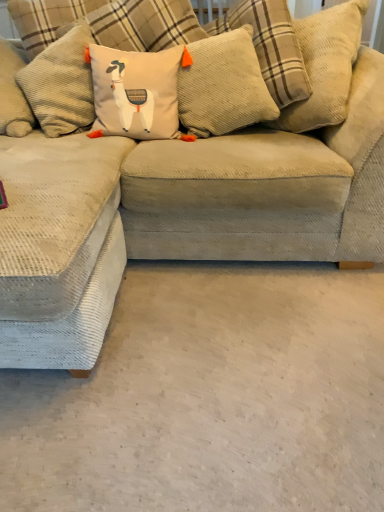
Question: Which direction should I rotate to look at corduroy pillow at center, arranged as the third pillow when viewed from the left, — up or down?

Choices:
 (A) down
 (B) up

Answer: (B)

Question: Can you confirm if corduroy pillow at center, the 2th pillow from the right, is wider than beige corduroy couch at center?

Choices:
 (A) no
 (B) yes

Answer: (A)

Question: Is corduroy pillow at center, the 2th pillow from the right, positioned behind beige corduroy couch at center?

Choices:
 (A) no
 (B) yes

Answer: (B)

Question: Does corduroy pillow at center, placed as the second pillow when sorted from left to right, have a lesser width compared to beige corduroy couch at center?

Choices:
 (A) yes
 (B) no

Answer: (A)

Question: Is corduroy pillow at center, placed as the second pillow when sorted from left to right, closer to camera compared to beige corduroy couch at center?

Choices:
 (A) yes
 (B) no

Answer: (B)

Question: Does corduroy pillow at center, placed as the second pillow when sorted from left to right, have a lesser height compared to beige corduroy couch at center?

Choices:
 (A) no
 (B) yes

Answer: (B)

Question: Is corduroy pillow at center, placed as the second pillow when sorted from left to right, positioned with its back to beige corduroy couch at center?

Choices:
 (A) no
 (B) yes

Answer: (B)

Question: Does corduroy pillow at center, placed as the second pillow when sorted from left to right, have a greater height compared to white carpet at lower left?

Choices:
 (A) yes
 (B) no

Answer: (A)

Question: Considering the relative sizes of corduroy pillow at center, the 2th pillow from the right, and white carpet at lower left in the image provided, is corduroy pillow at center, the 2th pillow from the right, shorter than white carpet at lower left?

Choices:
 (A) no
 (B) yes

Answer: (A)

Question: Could you tell me if corduroy pillow at center, the 2th pillow from the right, is turned towards white carpet at lower left?

Choices:
 (A) yes
 (B) no

Answer: (B)

Question: Is white carpet at lower left completely or partially inside corduroy pillow at center, placed as the second pillow when sorted from left to right?

Choices:
 (A) yes
 (B) no

Answer: (B)

Question: Is corduroy pillow at center, the 2th pillow from the right, positioned with its back to white carpet at lower left?

Choices:
 (A) yes
 (B) no

Answer: (B)

Question: Can you confirm if corduroy pillow at center, the 2th pillow from the right, is wider than white carpet at lower left?

Choices:
 (A) no
 (B) yes

Answer: (A)

Question: From a real-world perspective, is corduroy pillow at center, placed as the second pillow when sorted from left to right, positioned under beige corduroy pillow with llama design at center, placed as the third pillow when sorted from right to left, based on gravity?

Choices:
 (A) yes
 (B) no

Answer: (B)